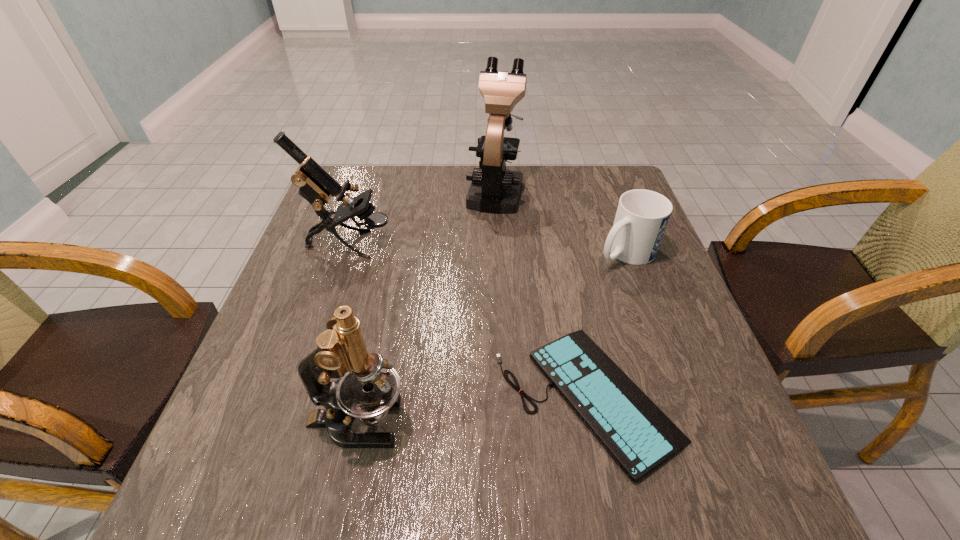
This screenshot has width=960, height=540. I want to click on unoccupied area between the second farthest microscope and the fourth tallest object, so click(488, 248).

What are the coordinates of `free space between the farthest microscope and the computer keyboard` in the screenshot? It's located at (540, 293).

In order to click on object that is the third closest to the second farthest microscope in this screenshot , I will do coord(371,386).

Locate which object is the second closest to the second farthest microscope. Please provide its 2D coordinates. Your answer should be formatted as a tuple, i.e. [(x, y)], where the tuple contains the x and y coordinates of a point satisfying the conditions above.

[(636, 433)]

Locate which microscope is the second closest to the farthest object. Please provide its 2D coordinates. Your answer should be formatted as a tuple, i.e. [(x, y)], where the tuple contains the x and y coordinates of a point satisfying the conditions above.

[(371, 386)]

Identify which microscope is located as the nearest to the second nearest microscope. Please provide its 2D coordinates. Your answer should be formatted as a tuple, i.e. [(x, y)], where the tuple contains the x and y coordinates of a point satisfying the conditions above.

[(494, 189)]

Locate an element on the screen. free spot that satisfies the following two spatial constraints: 1. through the eyepiece of the second farthest microscope; 2. on the left side of the shortest object is located at coordinates (300, 396).

Identify the location of vacant space that satisfies the following two spatial constraints: 1. on the front side of the farthest object; 2. through the eyepiece of the second farthest microscope. This screenshot has width=960, height=540. (497, 244).

You are a GUI agent. You are given a task and a screenshot of the screen. Output one action in this format:
    pyautogui.click(x=<x>, y=<y>)
    Task: Click on the free spot that satisfies the following two spatial constraints: 1. on the front side of the computer keyboard; 2. on the left side of the farthest microscope
    The image size is (960, 540).
    Given the screenshot: What is the action you would take?
    (x=504, y=396)